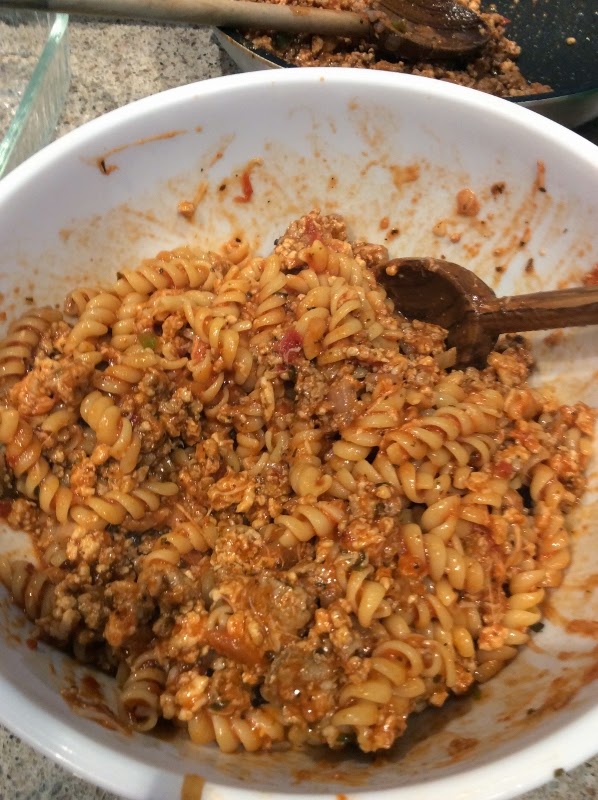
This screenshot has height=800, width=598. I want to click on rim of bowl, so click(x=503, y=780), click(x=551, y=94).